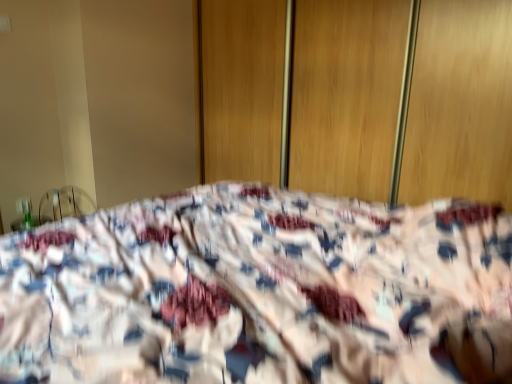
Question: From a real-world perspective, is fluffy fabric bed at center positioned above or below wooden screen door at center?

Choices:
 (A) above
 (B) below

Answer: (B)

Question: From the image's perspective, relative to wooden screen door at center, is fluffy fabric bed at center above or below?

Choices:
 (A) above
 (B) below

Answer: (B)

Question: In terms of height, does fluffy fabric bed at center look taller or shorter compared to wooden screen door at center?

Choices:
 (A) short
 (B) tall

Answer: (A)

Question: Is wooden screen door at center inside or outside of fluffy fabric bed at center?

Choices:
 (A) inside
 (B) outside

Answer: (B)

Question: Would you say wooden screen door at center is to the left or to the right of fluffy fabric bed at center in the picture?

Choices:
 (A) left
 (B) right

Answer: (B)

Question: From a real-world perspective, relative to fluffy fabric bed at center, is wooden screen door at center vertically above or below?

Choices:
 (A) above
 (B) below

Answer: (A)

Question: From their relative heights in the image, would you say wooden screen door at center is taller or shorter than fluffy fabric bed at center?

Choices:
 (A) tall
 (B) short

Answer: (A)